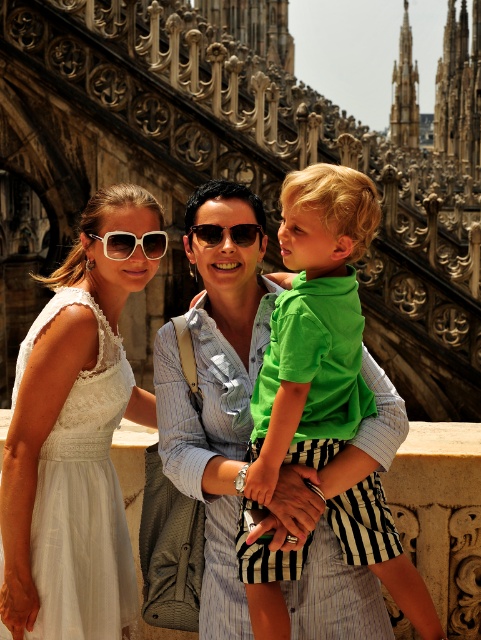
Question: Can you confirm if green matte shirt at center is thinner than sunglasses at center?

Choices:
 (A) yes
 (B) no

Answer: (B)

Question: Which point is closer to the camera taking this photo?

Choices:
 (A) (317, 182)
 (B) (239, 225)
 (C) (161, 248)
 (D) (52, 406)

Answer: (D)

Question: Which point is closer to the camera taking this photo?

Choices:
 (A) (231, 237)
 (B) (140, 214)
 (C) (252, 608)

Answer: (C)

Question: Is green matte shirt at center above white plastic sunglasses at upper center?

Choices:
 (A) no
 (B) yes

Answer: (A)

Question: Among these objects, which one is nearest to the camera?

Choices:
 (A) white plastic sunglasses at upper center
 (B) sunglasses at center
 (C) white lace dress at center

Answer: (C)

Question: Is green matte shirt at center to the left of white plastic sunglasses at upper center from the viewer's perspective?

Choices:
 (A) yes
 (B) no

Answer: (B)